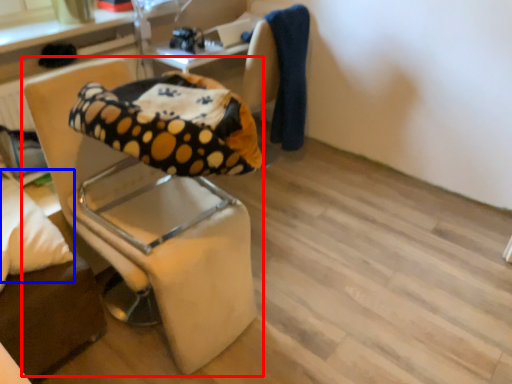
Question: Among these objects, which one is nearest to the camera, chair (highlighted by a red box) or pillow (highlighted by a blue box)?

Choices:
 (A) chair
 (B) pillow

Answer: (A)